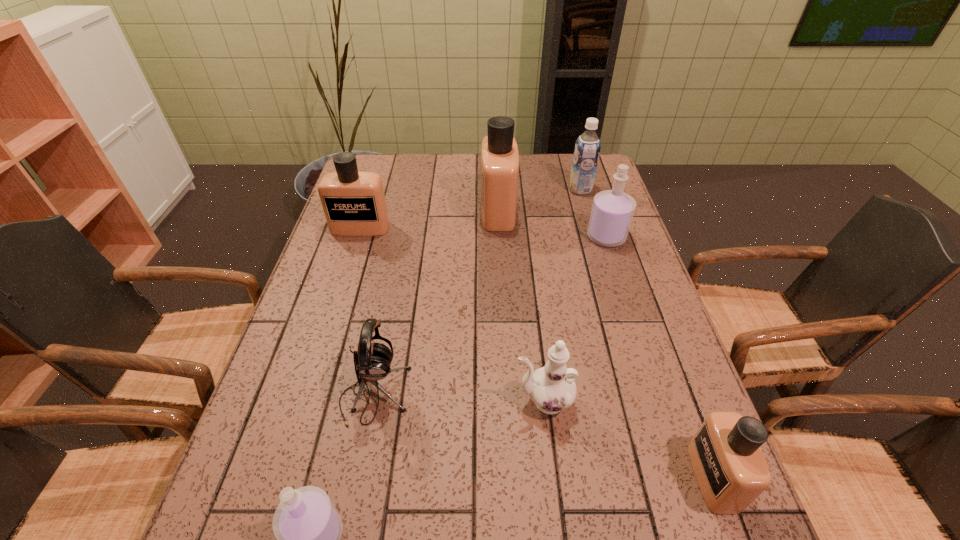
Locate an element on the screen. This screenshot has height=540, width=960. blank area located 0.300m at the spout of the chinaware is located at coordinates (371, 401).

Locate an element on the screen. The image size is (960, 540). vacant area situated 0.110m on the front of the black earphone is located at coordinates (357, 484).

At what (x,y) coordinates should I click in order to perform the action: click on free region located on the front label of the smallest beige perfume. Please return your answer as a coordinate pair (x, y). Image resolution: width=960 pixels, height=540 pixels. Looking at the image, I should click on (625, 477).

You are a GUI agent. You are given a task and a screenshot of the screen. Output one action in this format:
    pyautogui.click(x=<x>, y=<y>)
    Task: Click on the free point located 0.090m on the front label of the smallest beige perfume
    
    Given the screenshot: What is the action you would take?
    pyautogui.click(x=646, y=477)

Where is `vacant space located 0.260m on the front label of the smallest beige perfume`? Image resolution: width=960 pixels, height=540 pixels. vacant space located 0.260m on the front label of the smallest beige perfume is located at coordinates (554, 477).

At what (x,y) coordinates should I click in order to perform the action: click on object that is at the far edge. Please return your answer as a coordinate pair (x, y). This screenshot has height=540, width=960. Looking at the image, I should click on (587, 148).

I want to click on perfume located at the left edge, so click(x=354, y=204).

Where is `earphone that is at the left edge`? The image size is (960, 540). earphone that is at the left edge is located at coordinates (372, 361).

At what (x,y) coordinates should I click in order to perform the action: click on soya milk that is at the right edge. Please return your answer as a coordinate pair (x, y). The width and height of the screenshot is (960, 540). Looking at the image, I should click on (587, 148).

The width and height of the screenshot is (960, 540). Identify the location of object located at the far right corner. (587, 148).